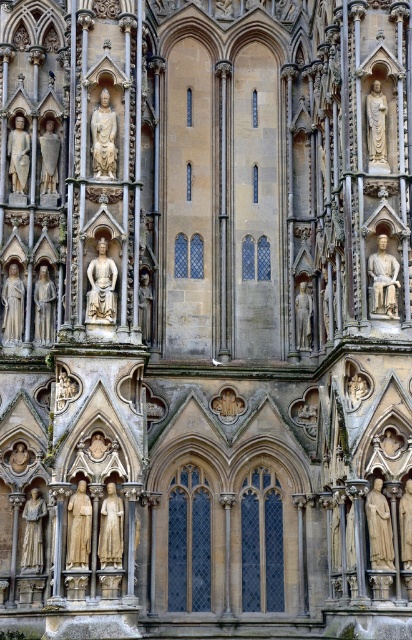
You are an art conservator examining the cathedral facade. You notice two statues, the stone statue at upper left and the matte stone statue at center left. Which statue is positioned higher up on the facade?

The stone statue at upper left is positioned higher up on the facade than the matte stone statue at center left.

You are an art restorer examining the cathedral facade. You need to move a ladder to access both the golden stone statue at lower left and the smooth stone statue at center. Based on their positions, which statue should you start with to minimize moving the ladder?

The golden stone statue at lower left is positioned on the left side of the smooth stone statue at center, so you should start with the golden stone statue at lower left to minimize moving the ladder since it is closer to the starting point on the left.

You are standing at the base of the cathedral facade and want to touch the stone statue at upper left. Given that the statue is 71.62 meters away from you, can you reach it without any assistance?

The stone statue at upper left is 71.62 meters away from the viewer, so you cannot reach it without assistance as that distance is far beyond human reach.